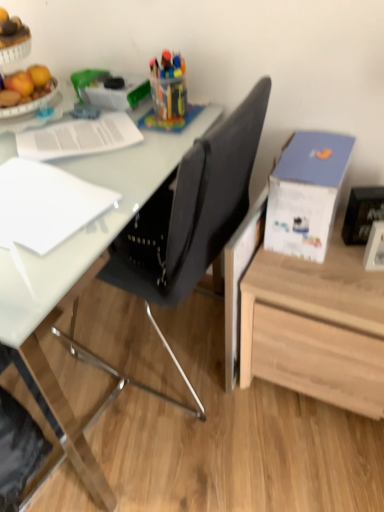
Identify the location of free space above white paper at upper left, placed as the 2th notebook when sorted from bottom to top (from a real-world perspective). (61, 130).